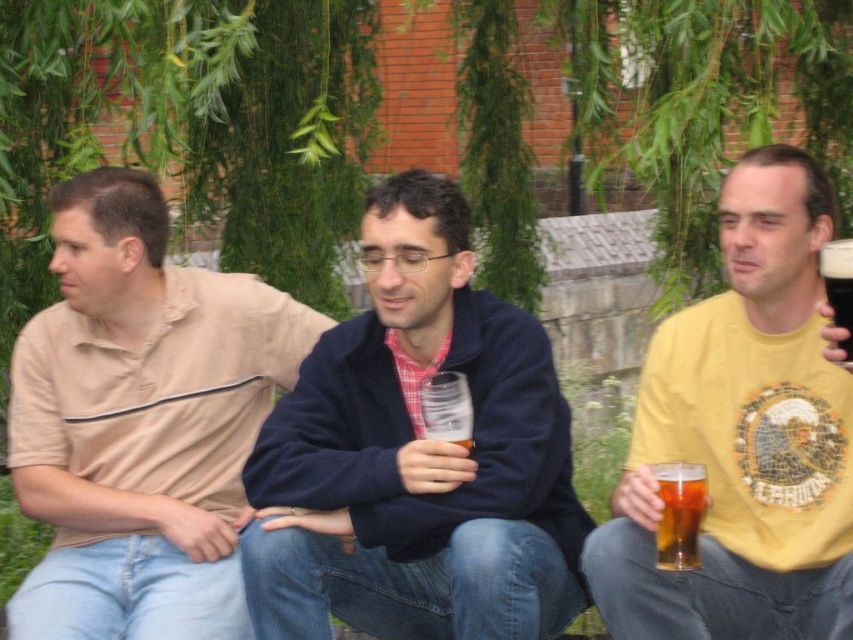
You are standing at the origin point in the image and want to walk towards the two points labeled as point (262,548) and point (810,493). Which point will you encounter first?

You will encounter point (810,493) first because it is in front of point (262,548), which is behind it.

You are standing in a park and see a point marked at coordinates (x=490, y=595). If you want to throw a frisbee to that point, will it land within 10 feet from you?

The point at coordinates (x=490, y=595) is 9.24 feet from the viewer, so yes, throwing the frisbee to that point will land it within 10 feet from you.